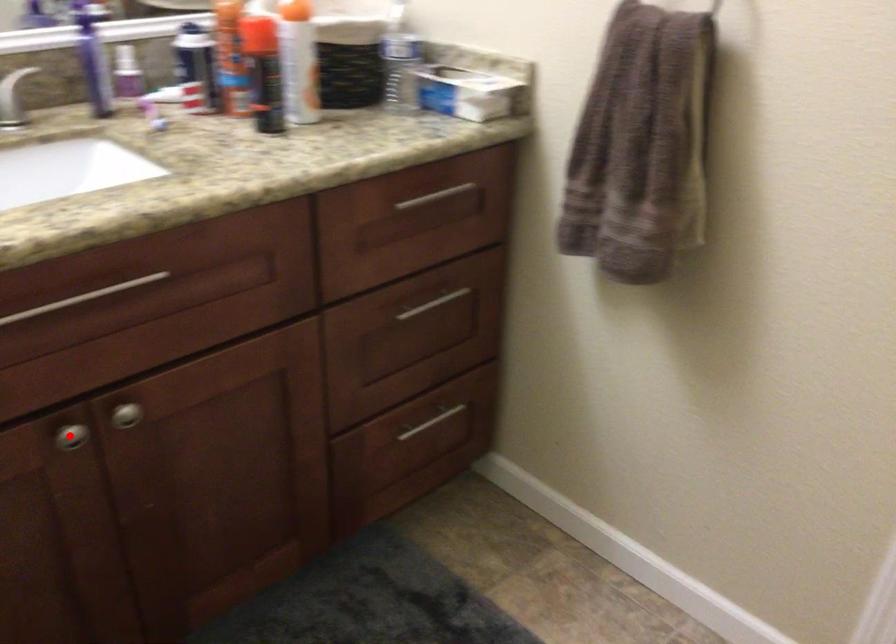
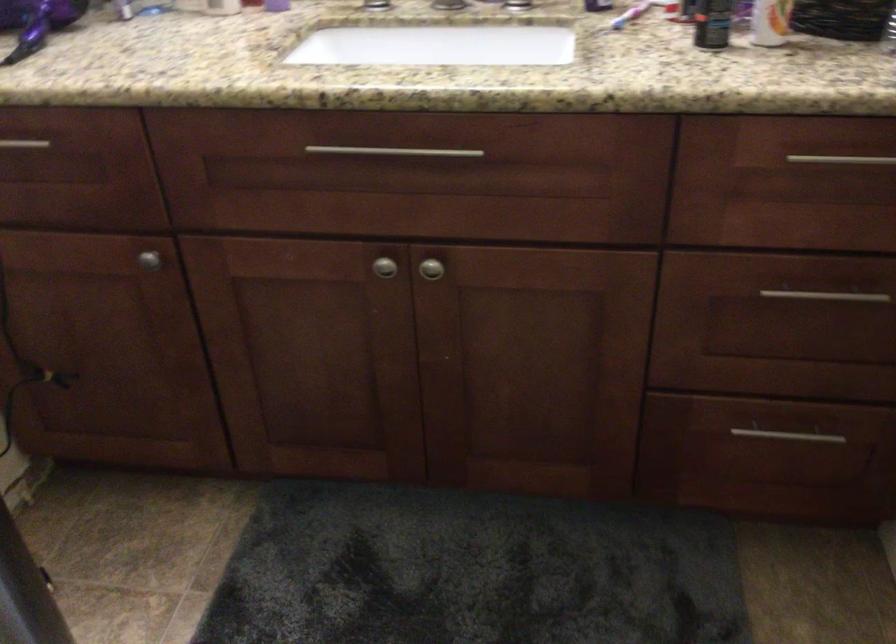
Question: I am providing you with two images of the same scene from different viewpoints. A red point is shown in image1. For the corresponding object point in image2, is it positioned nearer or farther from the camera?

Choices:
 (A) Nearer
 (B) Farther

Answer: (B)